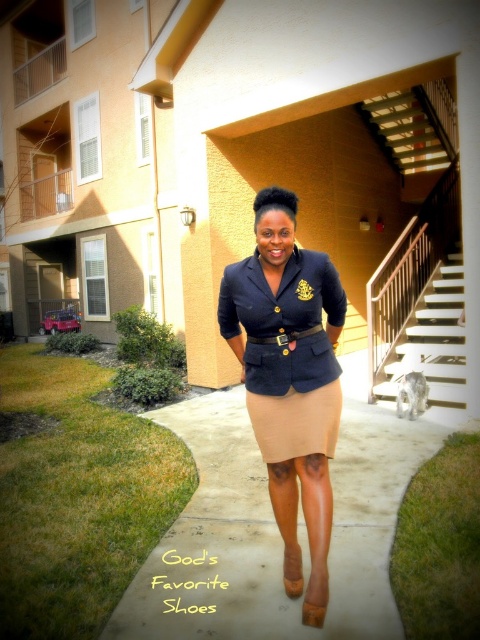
You are standing at the entrance of the residential building and want to walk towards the beige concrete pavement at center. What direction should you face to move directly towards it?

Since the beige concrete pavement at center is located at point (276, 525), you should face towards the center of the image to move directly towards it.

You are designing a poster and need to know which object in the scene takes up more space. Which one is larger between the beige concrete pavement at center and the matte black blazer at center?

The beige concrete pavement at center is bigger than the matte black blazer at center.

You are a delivery person trying to place a package on the ground near the person. Since the person is standing on the suede skirt at center, where should you place the package so it stays on the beige concrete pavement at center?

The beige concrete pavement at center is below the suede skirt at center, so placing the package on the beige concrete pavement at center will ensure it stays there as it is the ground level beneath the person.